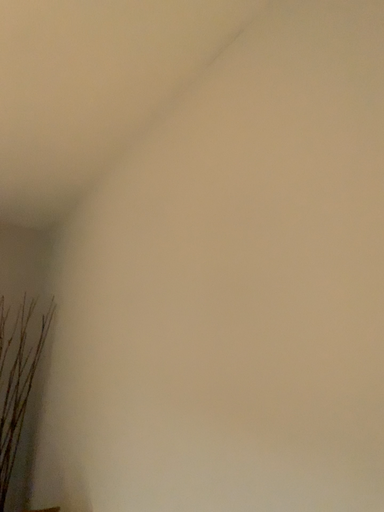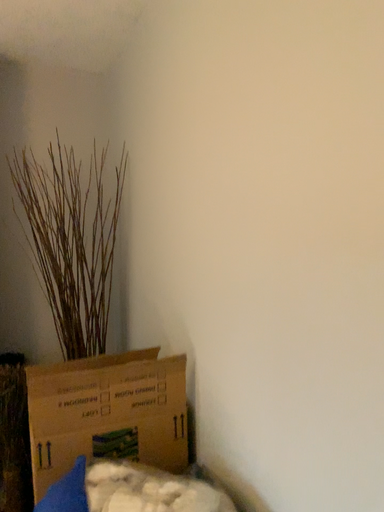
Question: How did the camera likely rotate when shooting the video?

Choices:
 (A) rotated downward
 (B) rotated upward

Answer: (A)